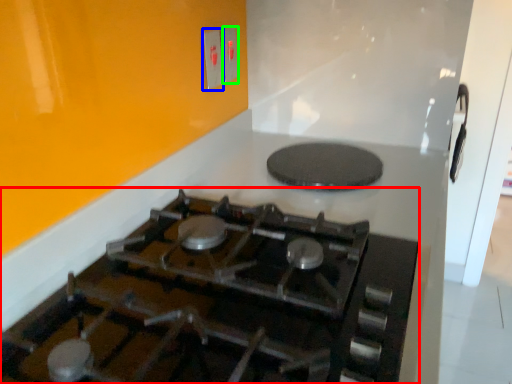
Question: Based on their relative distances, which object is farther from gas stove (highlighted by a red box)? Choose from electric outlet (highlighted by a blue box) and electric outlet (highlighted by a green box).

Choices:
 (A) electric outlet
 (B) electric outlet

Answer: (B)